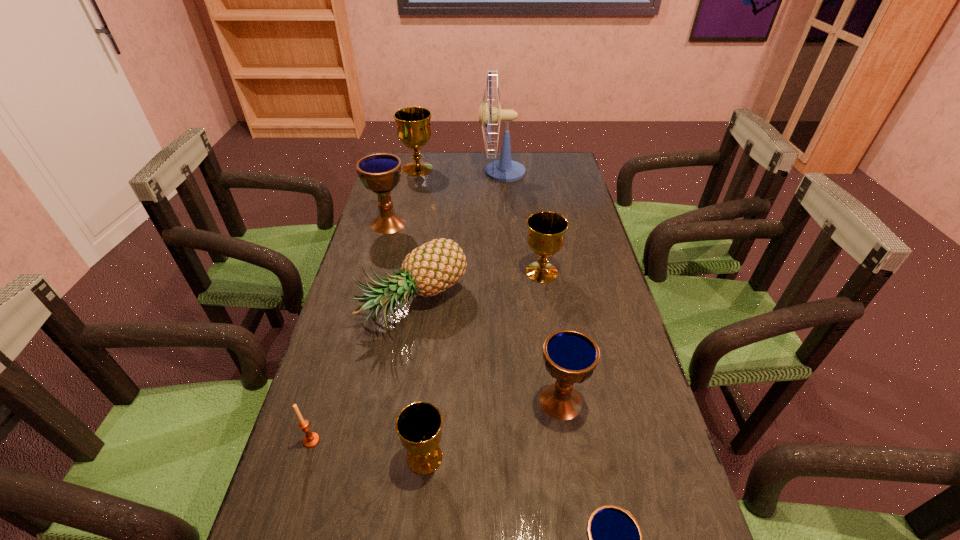
The image size is (960, 540). In order to click on free space located on the left of the sixth farthest object in this screenshot , I will do `click(514, 401)`.

You are a GUI agent. You are given a task and a screenshot of the screen. Output one action in this format:
    pyautogui.click(x=<x>, y=<y>)
    Task: Click on the blank area located on the right of the pineapple
    The image size is (960, 540).
    Given the screenshot: What is the action you would take?
    pyautogui.click(x=587, y=303)

Image resolution: width=960 pixels, height=540 pixels. Identify the location of vacant region located on the back of the second gold chalice from right to left. (436, 344).

What are the coordinates of `vacant region located 0.090m on the right of the candle_holder` in the screenshot? It's located at (363, 441).

Find the location of a particular element. The image size is (960, 540). fan present at the far edge is located at coordinates (504, 170).

Image resolution: width=960 pixels, height=540 pixels. I want to click on chalice at the far edge, so click(413, 123).

You are a GUI agent. You are given a task and a screenshot of the screen. Output one action in this format:
    pyautogui.click(x=<x>, y=<y>)
    Task: Click on the pineapple located at the left edge
    The width and height of the screenshot is (960, 540).
    Given the screenshot: What is the action you would take?
    pyautogui.click(x=435, y=266)

Image resolution: width=960 pixels, height=540 pixels. I want to click on candle_holder located at the left edge, so click(x=311, y=439).

Where is `object located in the far left corner section of the desktop`? object located in the far left corner section of the desktop is located at coordinates (413, 123).

Where is `free location at the far edge`? free location at the far edge is located at coordinates [519, 158].